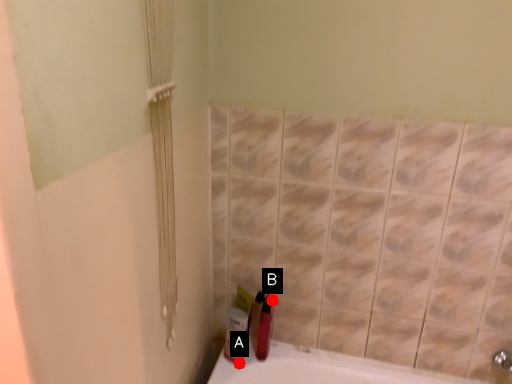
Question: Two points are circled on the image, labeled by A and B beside each circle. Which point is farther from the camera taking this photo?

Choices:
 (A) A is further
 (B) B is further

Answer: (B)